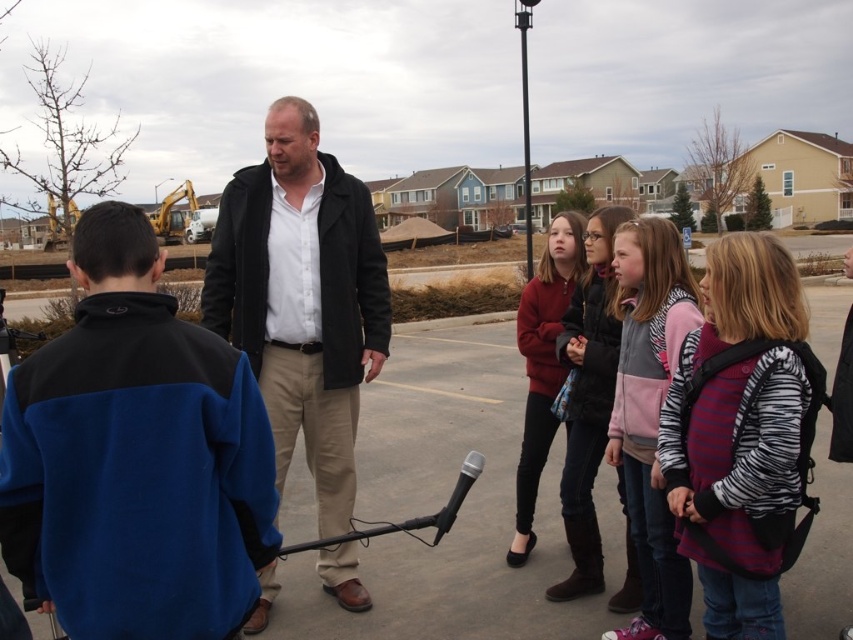
Question: Is matte black jacket at center to the left of dark brown leather boots at center from the viewer's perspective?

Choices:
 (A) yes
 (B) no

Answer: (A)

Question: Which of the following is the farthest from the observer?

Choices:
 (A) zebra print jacket at center
 (B) dark brown leather boots at center
 (C) matte red sweater at center
 (D) zebra-patterned backpack at center-right

Answer: (C)

Question: Is matte black jacket at center smaller than zebra-patterned backpack at center-right?

Choices:
 (A) yes
 (B) no

Answer: (A)

Question: Based on their relative distances, which object is farther from the matte red sweater at center?

Choices:
 (A) zebra print jacket at center
 (B) matte black jacket at center
 (C) dark brown leather boots at center

Answer: (B)

Question: Based on their relative distances, which object is farther from the zebra-patterned backpack at center-right?

Choices:
 (A) dark brown leather boots at center
 (B) matte black jacket at center
 (C) zebra print jacket at center
 (D) matte red sweater at center

Answer: (B)

Question: Can you confirm if matte black jacket at center is wider than matte red sweater at center?

Choices:
 (A) no
 (B) yes

Answer: (A)